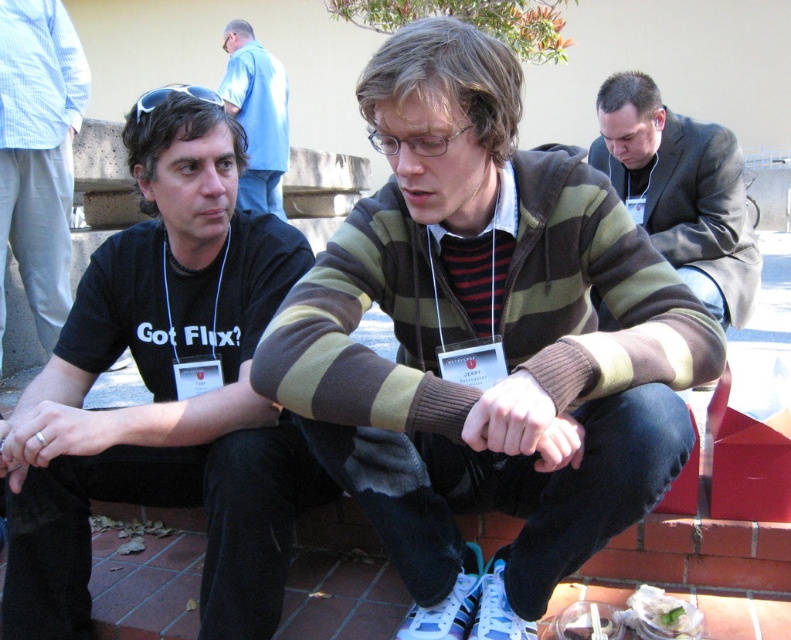
You are a photographer trying to capture a group photo of the striped sweater at center and dark gray suit at center. The camera you are using has a minimum focus distance of 5 feet. Will you be able to take a clear photo of both subjects at the same time?

The striped sweater at center and dark gray suit at center are 4.90 feet apart, which is less than the camera minimum focus distance of 5 feet. Therefore, the photographer will not be able to take a clear photo of both subjects at the same time.

What are the coordinates of the striped sweater at center?

The striped sweater at center is located at coordinates point (487,332).

You are at a social gathering and want to introduce yourself to both people wearing the striped sweater at center and the dark gray suit at center. Which one should you approach first if you are standing to the left of both individuals?

You should approach the striped sweater at center first because it is positioned on the left side of dark gray suit at center, so it is closer to you from your current position on the left.